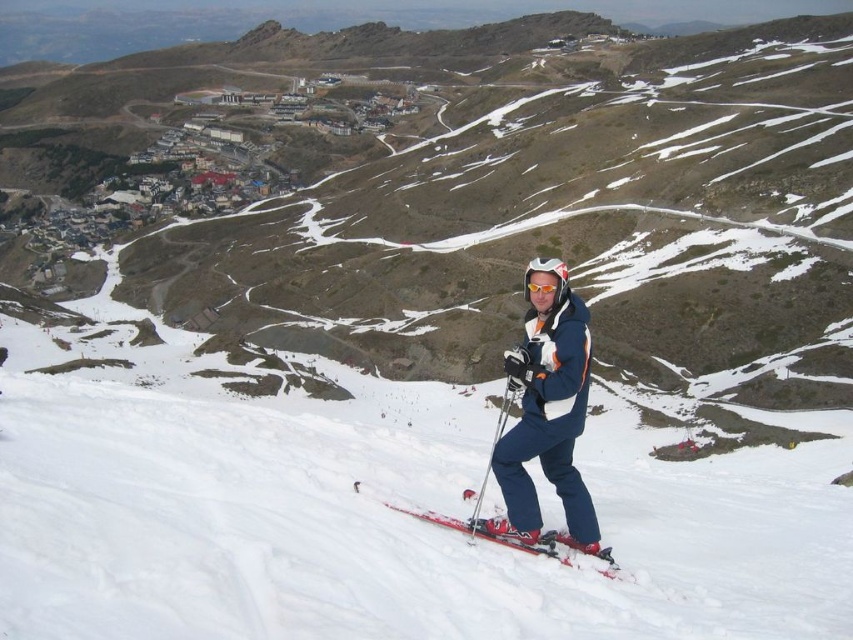
You are a photographer trying to capture the entire scene of the white snow ski slope at center and the orange reflective goggles at center in one shot. Given that your camera has a limited field of view, which object should you focus on to ensure both are visible without cropping?

Since the white snow ski slope at center is bigger than orange reflective goggles at center, you should focus on the white snow ski slope at center to ensure both objects are visible in the frame without cropping.

You are a photographer trying to capture the skier and the village in the background. Since the white snow ski slope at center and the red matte skis at center are both at the center, which one is positioned more to the left?

The white snow ski slope at center is positioned to the left of the red matte skis at center, so the white snow ski slope at center is more to the left.

You are a photographer trying to capture the orange reflective goggles at center in a photo. The white snow ski slope at center is blocking part of the view. Can you adjust your position to see the goggles without the slope blocking them?

The white snow ski slope at center is much taller than orange reflective goggles at center, so moving your position lower or to the side might allow you to see the goggles without the slope blocking them.